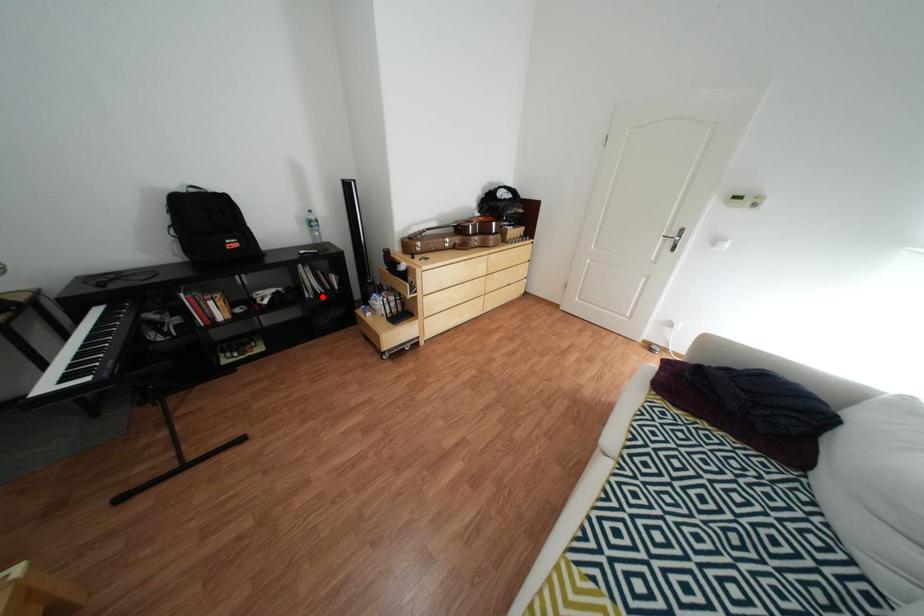
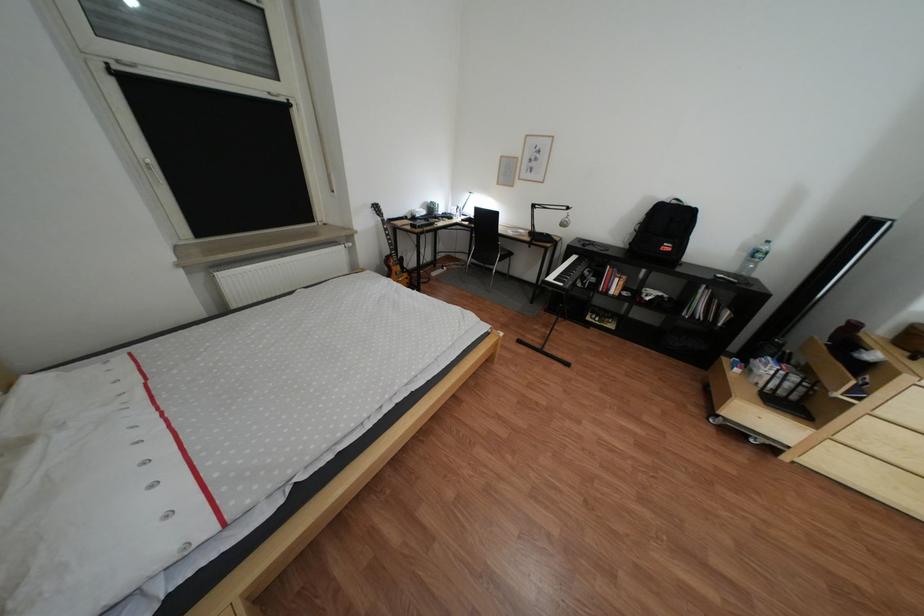
Find the pixel in the second image that matches the highlighted location in the first image.

(699, 315)